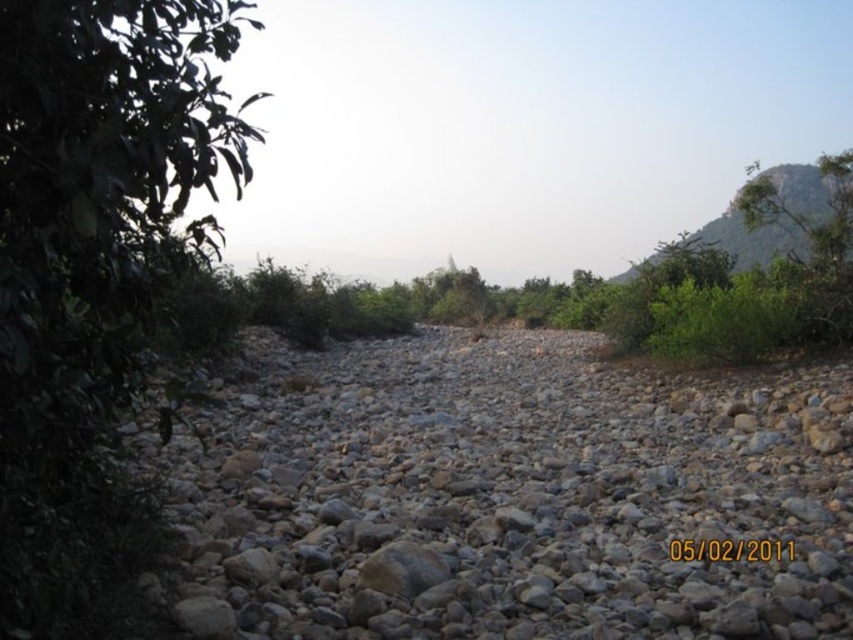
You are a hiker who wants to cross the dry riverbed. You see the gray rough gravel at center and the green leafy tree at upper right. Which object is closer to you, and why?

The gray rough gravel at center is closer to you because it is smaller than the green leafy tree at upper right, which means the tree is farther away.

You are standing in the dry riverbed and see the green leafy tree at left and the green leafy tree at upper right. Which tree is closer to you?

The green leafy tree at left is closer to you because it is in front of the green leafy tree at upper right.